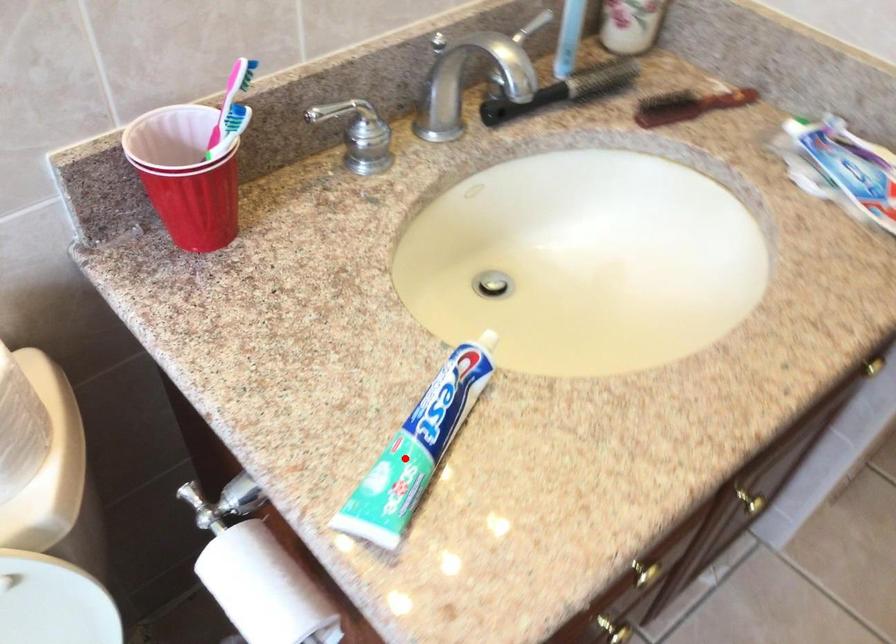
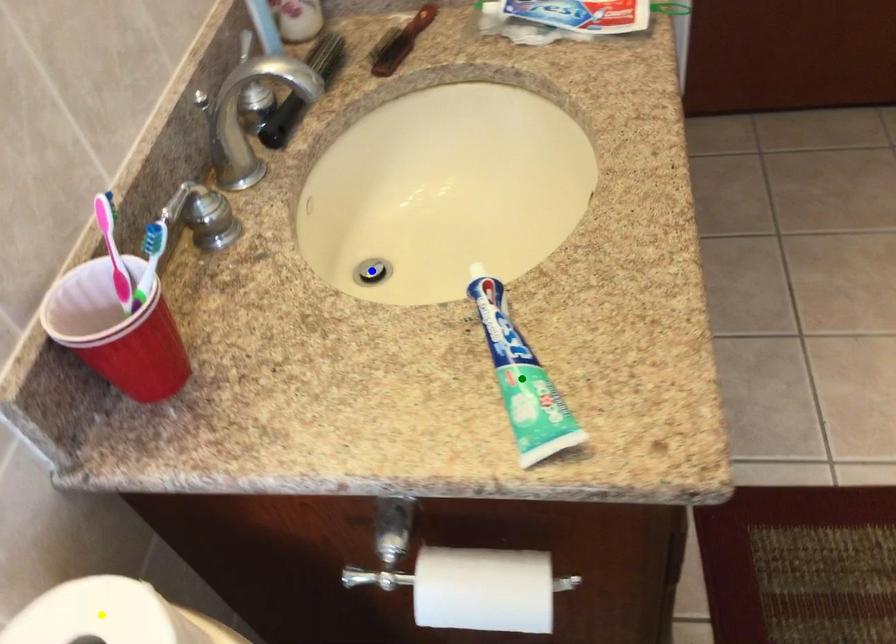
Question: I am providing you with two images of the same scene from different viewpoints. A red point is marked on the first image. You are given multiple points on the second image. Which point in image 2 is actually the same real-world point as the red point in image 1?

Choices:
 (A) yellow point
 (B) blue point
 (C) green point

Answer: (C)